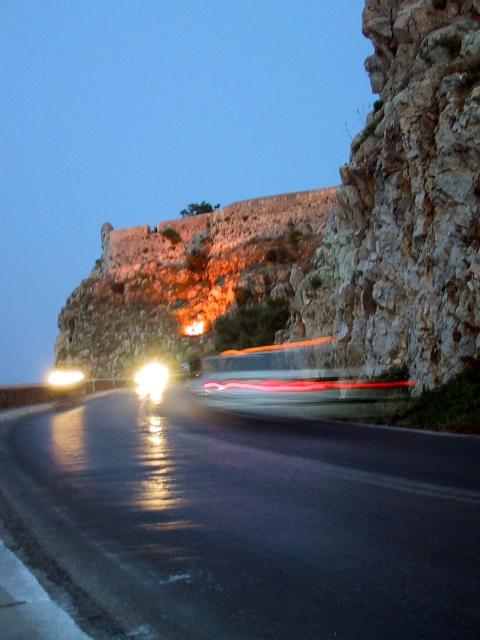
You are standing at the point with coordinates (252, 522) in the image. What object are you standing on?

The point at coordinates (252, 522) corresponds to the black asphalt road at center.

Consider the image. You are a pedestrian standing on the sidewalk next to the black asphalt road at center. You see the metallic silver bus at center approaching from behind. Which direction should you move to ensure safety?

Since the black asphalt road at center is to the left of the metallic silver bus at center, you should move to the right away from the road to ensure safety.